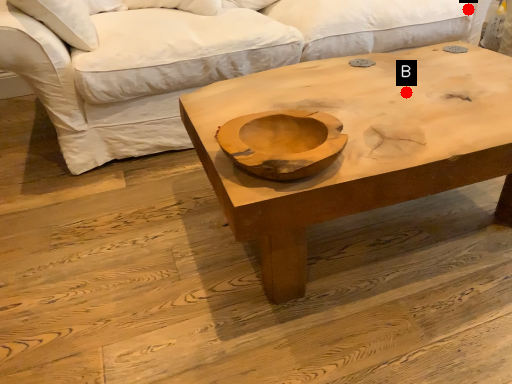
Question: Two points are circled on the image, labeled by A and B beside each circle. Which point is closer to the camera?

Choices:
 (A) A is closer
 (B) B is closer

Answer: (B)